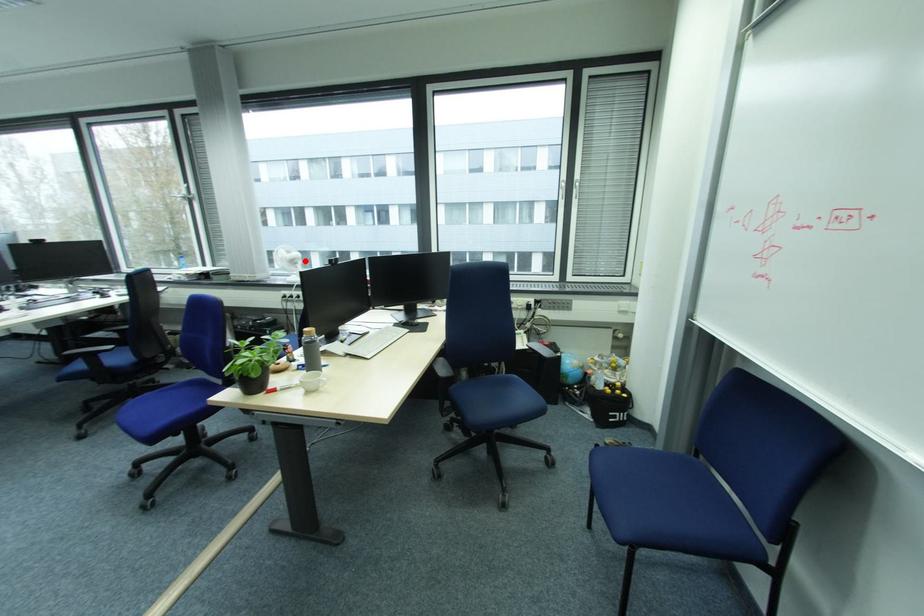
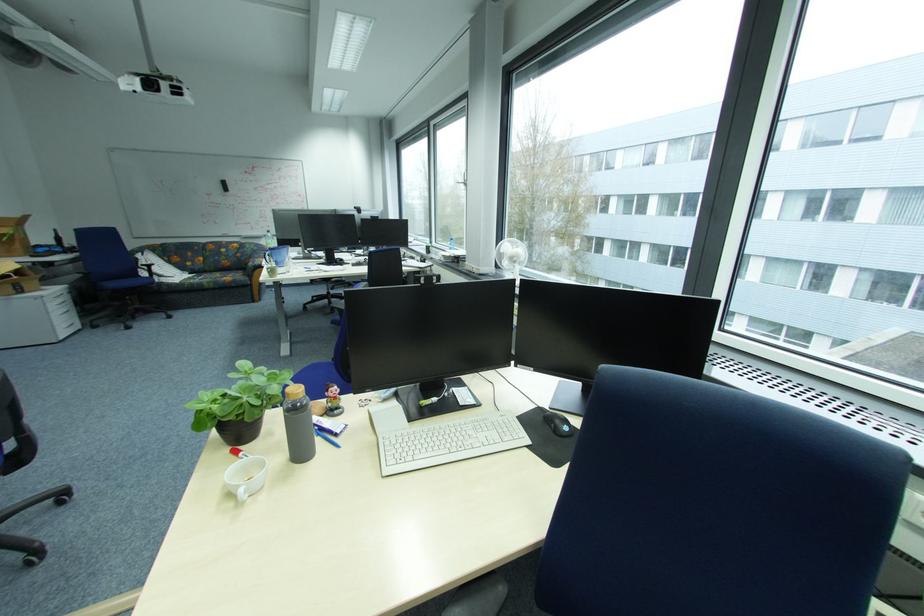
The point at the highlighted location is marked in the first image. Where is the corresponding point in the second image?

(524, 259)